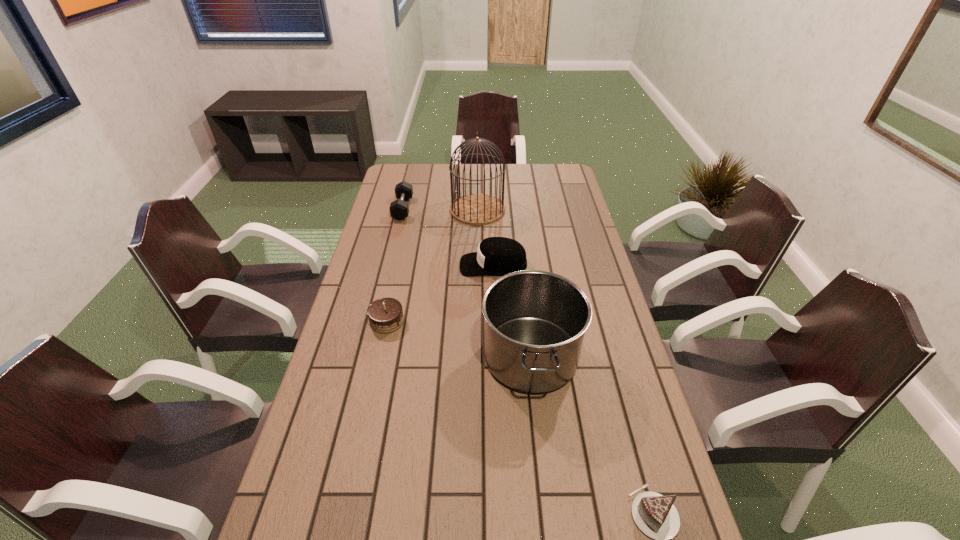
This screenshot has height=540, width=960. What are the coordinates of `free spot located 0.140m on the front-facing side of the third farthest object` in the screenshot? It's located at (420, 265).

At what (x,y) coordinates should I click in order to perform the action: click on free space located 0.140m on the front-facing side of the third farthest object. Please return your answer as a coordinate pair (x, y). Looking at the image, I should click on (420, 265).

Where is `free spot located 0.140m on the back of the left chocolate cake`? The height and width of the screenshot is (540, 960). free spot located 0.140m on the back of the left chocolate cake is located at coordinates (396, 280).

Locate an element on the screen. Image resolution: width=960 pixels, height=540 pixels. vacant space located 0.090m on the back of the dumbbell is located at coordinates (408, 186).

Identify the location of chocolate cake situated at the left edge. The image size is (960, 540). (385, 315).

You are a GUI agent. You are given a task and a screenshot of the screen. Output one action in this format:
    pyautogui.click(x=<x>, y=<y>)
    Task: Click on the dumbbell at the left edge
    The height and width of the screenshot is (540, 960).
    Given the screenshot: What is the action you would take?
    pyautogui.click(x=399, y=209)

This screenshot has height=540, width=960. What are the coordinates of `object located at the right edge` in the screenshot? It's located at [535, 321].

Find the location of `vacant region at the far edge`. vacant region at the far edge is located at coordinates (441, 184).

Locate an element on the screen. vacant area at the left edge is located at coordinates (322, 496).

The image size is (960, 540). In order to click on vacant space at the right edge of the desktop in this screenshot , I will do `click(600, 294)`.